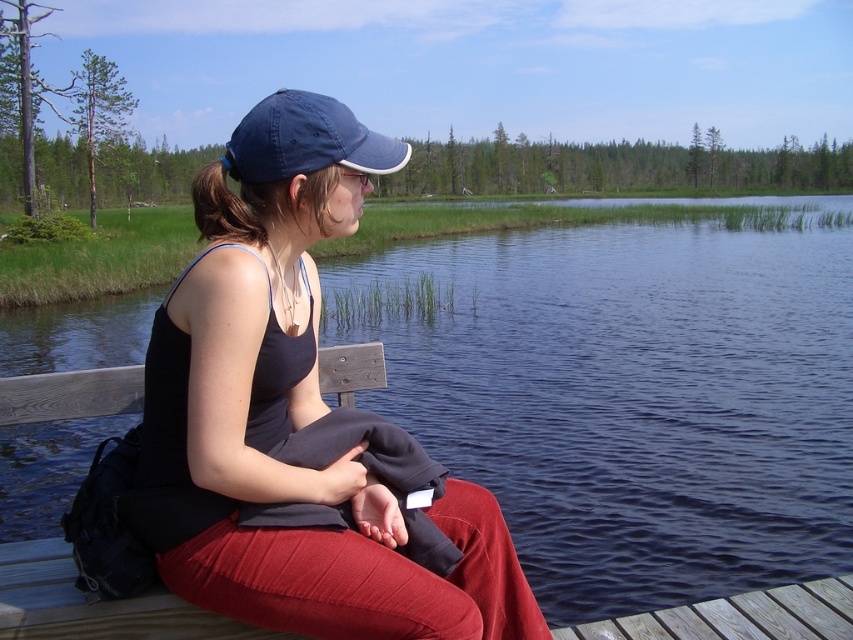
Looking at this image, you are a fashion designer analyzing the image for a new clothing line. You notice the matte black tank top at center and the navy blue fabric cap at upper center. Which of these two items appears to be the smaller one in the image?

The matte black tank top at center is smaller than the navy blue fabric cap at upper center in the image.

You are trying to determine which object in the scene is larger. You see the blue water at center and the navy blue fabric cap at upper center. Which one is bigger?

The blue water at center is bigger than the navy blue fabric cap at upper center.